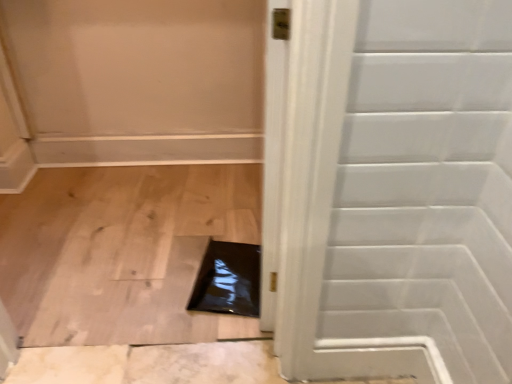
The width and height of the screenshot is (512, 384). Find the location of `vacant area to the left of black glossy hole at center`. vacant area to the left of black glossy hole at center is located at coordinates [156, 273].